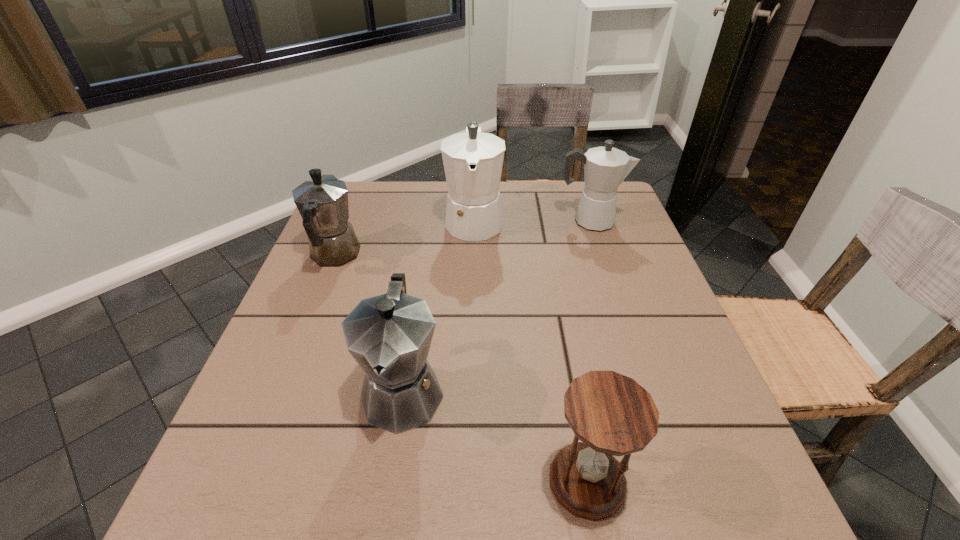
This screenshot has width=960, height=540. Identify the location of empty location between the tallest object and the shortest object. (531, 350).

Where is `vacant area between the leftmost object and the hourglass`? Image resolution: width=960 pixels, height=540 pixels. vacant area between the leftmost object and the hourglass is located at coordinates (461, 368).

Identify the location of the third closest object to the nearest coffeepot. The height and width of the screenshot is (540, 960). (473, 161).

Find the location of a particular element. This screenshot has height=540, width=960. object that is the second closest to the leftmost object is located at coordinates (389, 336).

Select which coffeepot is the second closest to the leftmost coffeepot. Please provide its 2D coordinates. Your answer should be formatted as a tuple, i.e. [(x, y)], where the tuple contains the x and y coordinates of a point satisfying the conditions above.

[(389, 336)]

Select which coffeepot is the third closest to the rightmost coffeepot. Please provide its 2D coordinates. Your answer should be formatted as a tuple, i.e. [(x, y)], where the tuple contains the x and y coordinates of a point satisfying the conditions above.

[(322, 202)]

In order to click on free location that satisfies the following two spatial constraints: 1. on the back side of the rightmost coffeepot; 2. on the left side of the hourglass in this screenshot , I will do `click(540, 221)`.

The height and width of the screenshot is (540, 960). Identify the location of free space that satisfies the following two spatial constraints: 1. at the spout of the tallest object; 2. on the left side of the rightmost coffeepot. (474, 221).

The width and height of the screenshot is (960, 540). I want to click on vacant area in the image that satisfies the following two spatial constraints: 1. at the spout of the tallest coffeepot; 2. on the right side of the nearest object, so click(469, 481).

This screenshot has width=960, height=540. What are the coordinates of `vacant area in the image that satisfies the following two spatial constraints: 1. at the spout of the nearest coffeepot; 2. on the left side of the shortest object` in the screenshot? It's located at (389, 481).